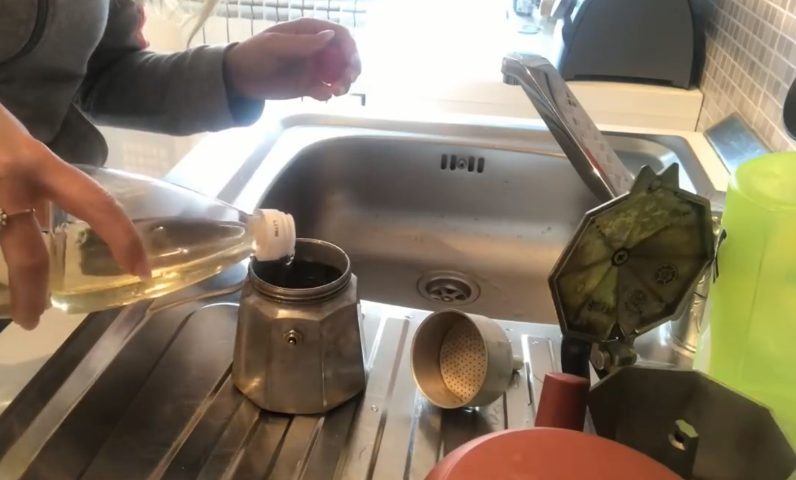
Find the location of a particular element. The image size is (796, 480). bottom part of coffee maker is located at coordinates (301, 385).